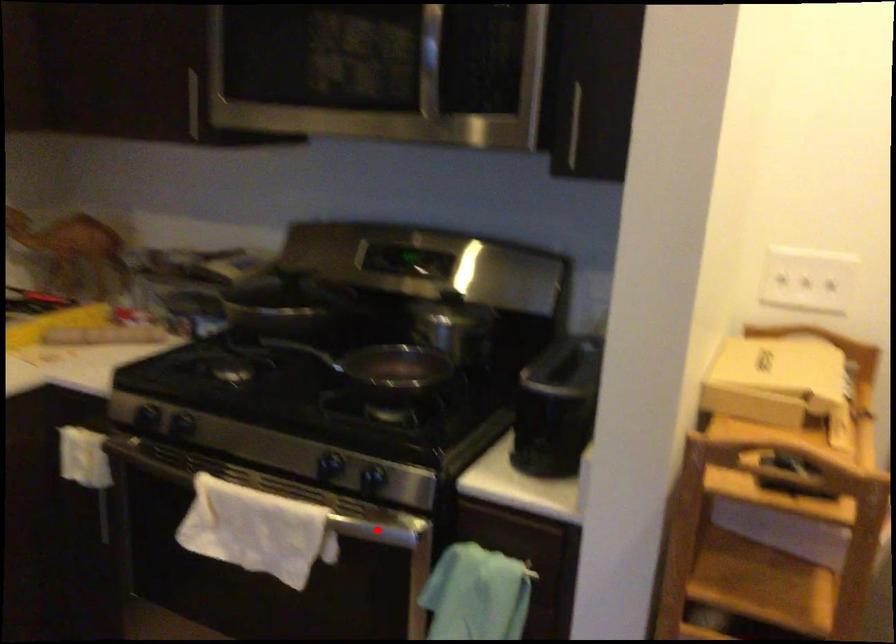
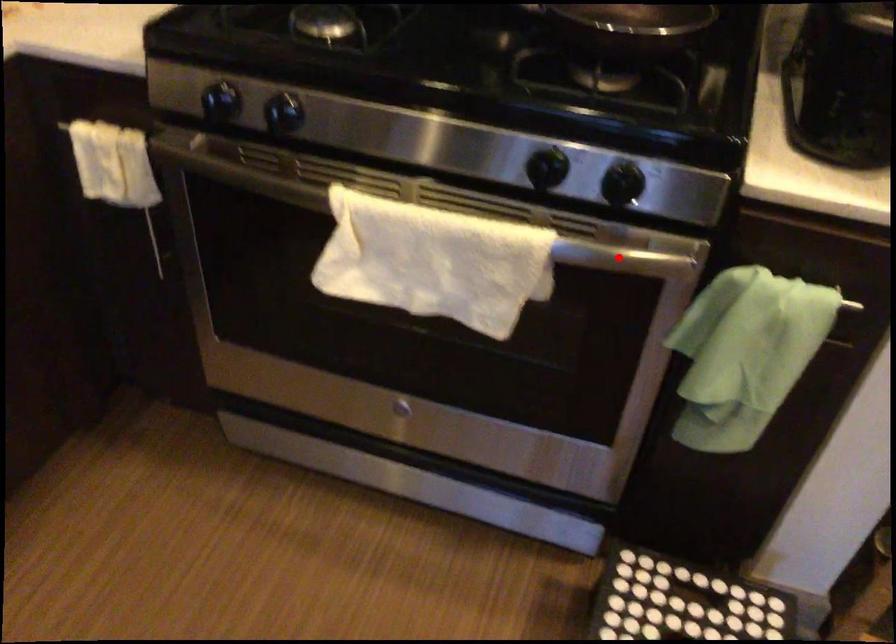
Consider the image. I am providing you with two images of the same scene from different viewpoints. A red point is marked on the first image and another point is marked on the second image. Are the points marked in image1 and image2 representing the same 3D position?

Yes